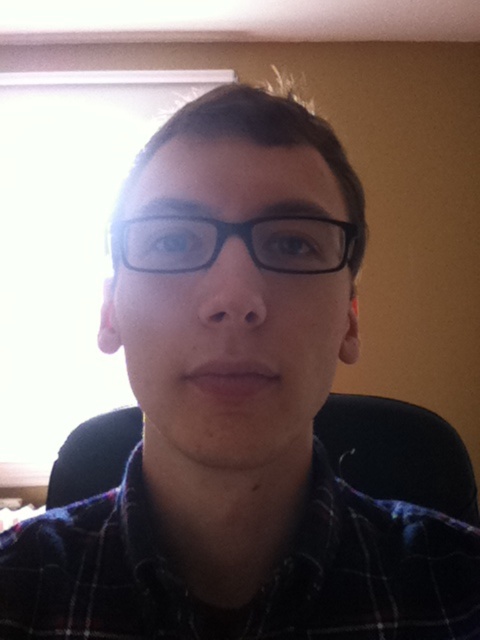
Question: Which point appears farthest from the camera in this image?

Choices:
 (A) (116, 256)
 (B) (279, 305)

Answer: (A)

Question: Is black matte glasses at center smaller than black plastic glasses at center?

Choices:
 (A) yes
 (B) no

Answer: (B)

Question: Does black fabric swivel chair at center have a greater width compared to black plastic glasses at center?

Choices:
 (A) yes
 (B) no

Answer: (A)

Question: Estimate the real-world distances between objects in this image. Which object is closer to the black fabric swivel chair at center?

Choices:
 (A) black matte glasses at center
 (B) plaid fabric at center
 (C) black plastic glasses at center

Answer: (B)

Question: Which point is closer to the camera?

Choices:
 (A) (431, 529)
 (B) (159, 218)
 (C) (264, 250)

Answer: (B)

Question: Is the position of black matte glasses at center more distant than that of black fabric swivel chair at center?

Choices:
 (A) yes
 (B) no

Answer: (B)